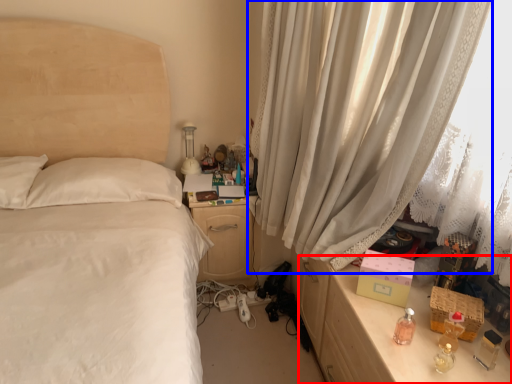
Question: Which object appears farthest to the camera in this image, vanity (highlighted by a red box) or curtain (highlighted by a blue box)?

Choices:
 (A) vanity
 (B) curtain

Answer: (A)